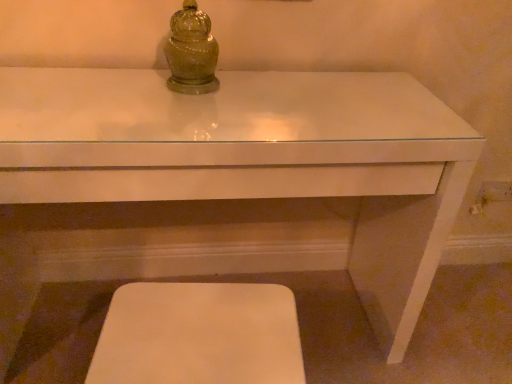
Question: From the image's perspective, is white glossy table at center above or below white matte step stool at lower center?

Choices:
 (A) below
 (B) above

Answer: (B)

Question: Considering the positions of point (202, 119) and point (288, 332), is point (202, 119) closer or farther from the camera than point (288, 332)?

Choices:
 (A) farther
 (B) closer

Answer: (A)

Question: Estimate the real-world distances between objects in this image. Which object is farther from the green glass jar at upper center?

Choices:
 (A) white glossy table at center
 (B) white matte step stool at lower center

Answer: (B)

Question: Based on their relative distances, which object is nearer to the green glass jar at upper center?

Choices:
 (A) white matte step stool at lower center
 (B) white glossy table at center

Answer: (B)